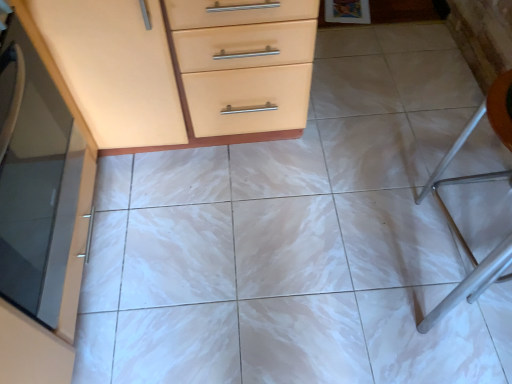
At what (x,y) coordinates should I click in order to perform the action: click on vacant space situated on the left part of orange plastic folding chair at right. Please return your answer as a coordinate pair (x, y). Looking at the image, I should click on (353, 246).